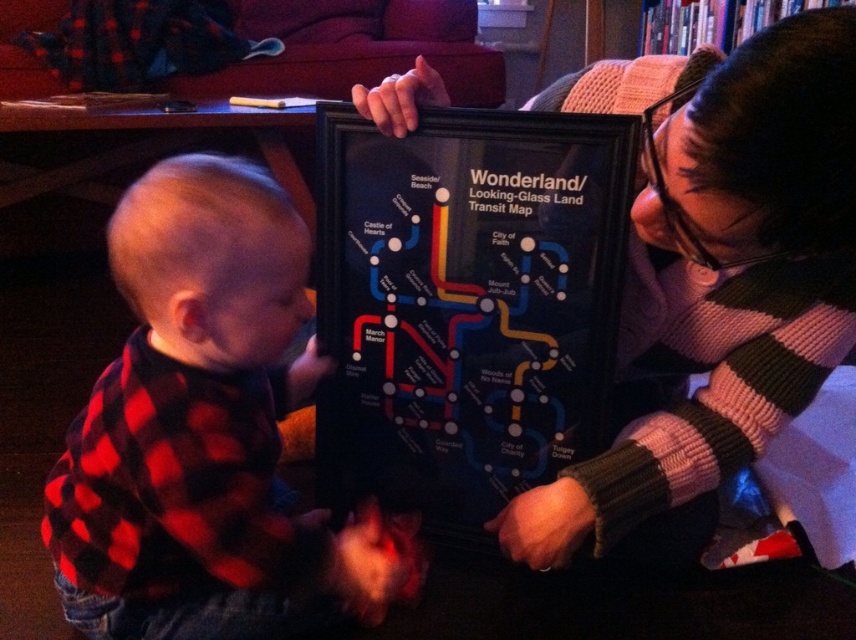
Is knitted sweater at center thinner than red plaid shirt at left?

No, knitted sweater at center is not thinner than red plaid shirt at left.

Does point (698, 204) come behind point (369, 563)?

No, (698, 204) is in front of (369, 563).

Who is more distant from viewer, (676,128) or (378,605)?

Positioned behind is point (378,605).

Where is `knitted sweater at center`? The image size is (856, 640). knitted sweater at center is located at coordinates (716, 268).